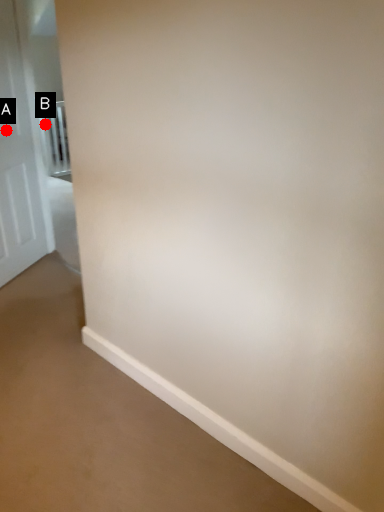
Question: Two points are circled on the image, labeled by A and B beside each circle. Which point is closer to the camera?

Choices:
 (A) A is closer
 (B) B is closer

Answer: (A)